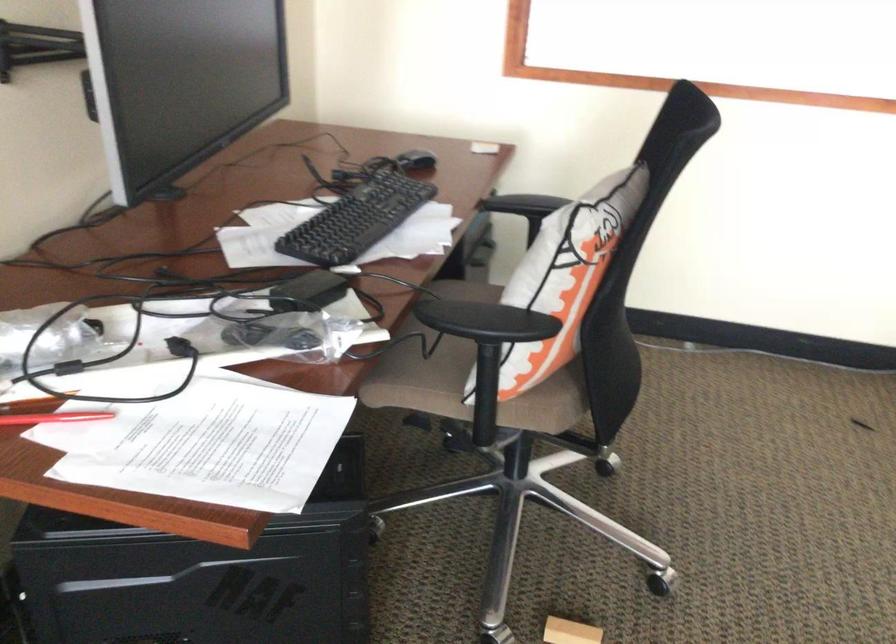
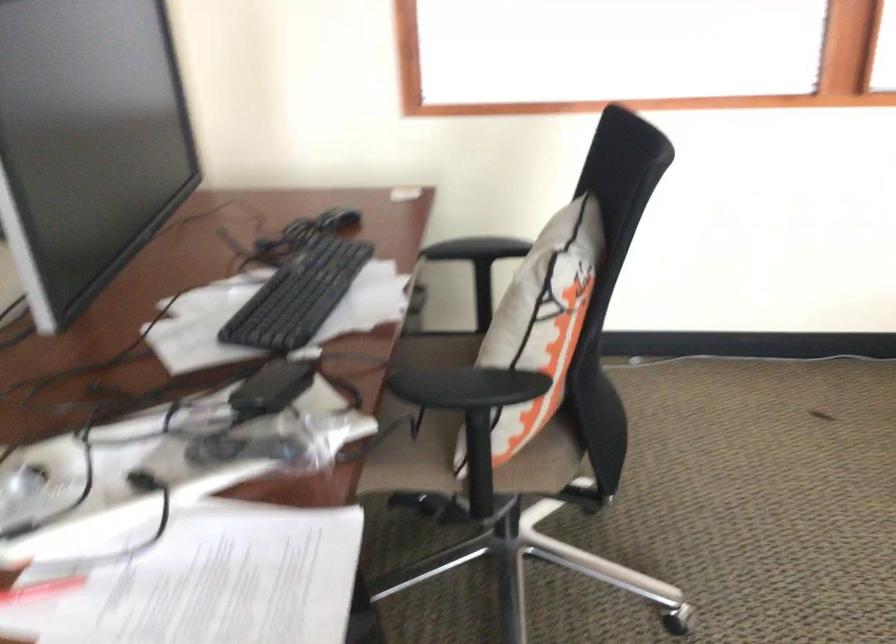
Question: How did the camera likely rotate?

Choices:
 (A) Left
 (B) Right
 (C) Up
 (D) Down

Answer: (B)